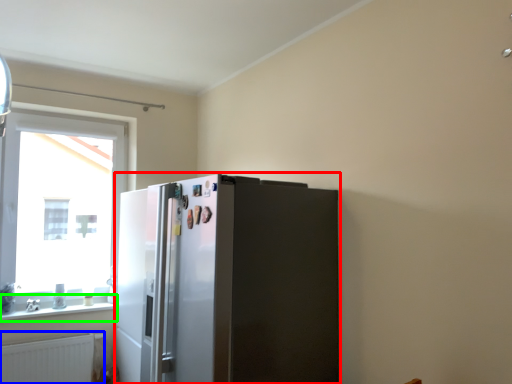
Question: Which object is positioned farthest from refrigerator (highlighted by a red box)? Select from radiator (highlighted by a blue box) and window sill (highlighted by a green box).

Choices:
 (A) radiator
 (B) window sill

Answer: (B)